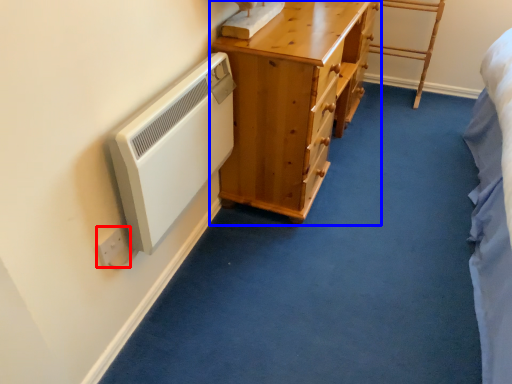
Question: Which object appears closest to the camera in this image, electric outlet (highlighted by a red box) or chest of drawers (highlighted by a blue box)?

Choices:
 (A) electric outlet
 (B) chest of drawers

Answer: (A)